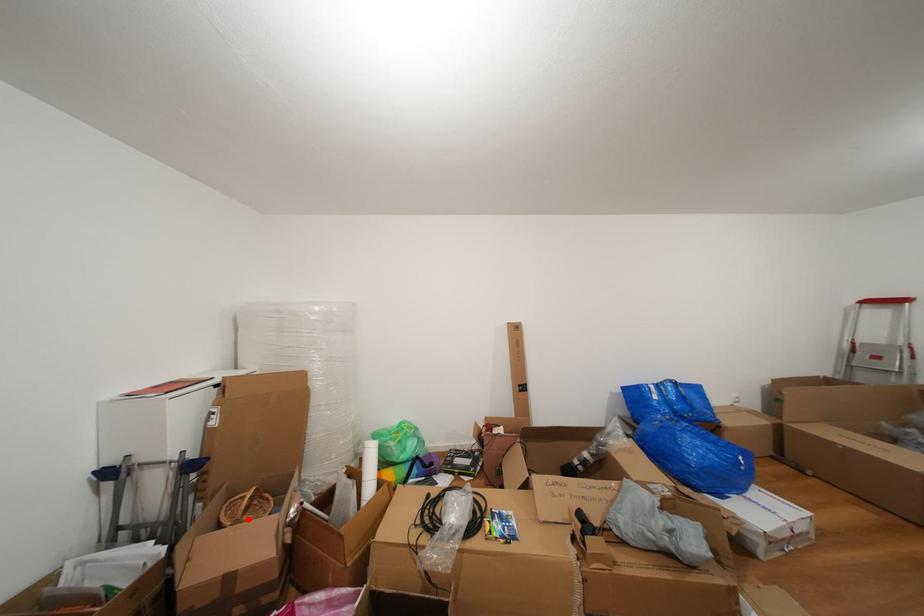
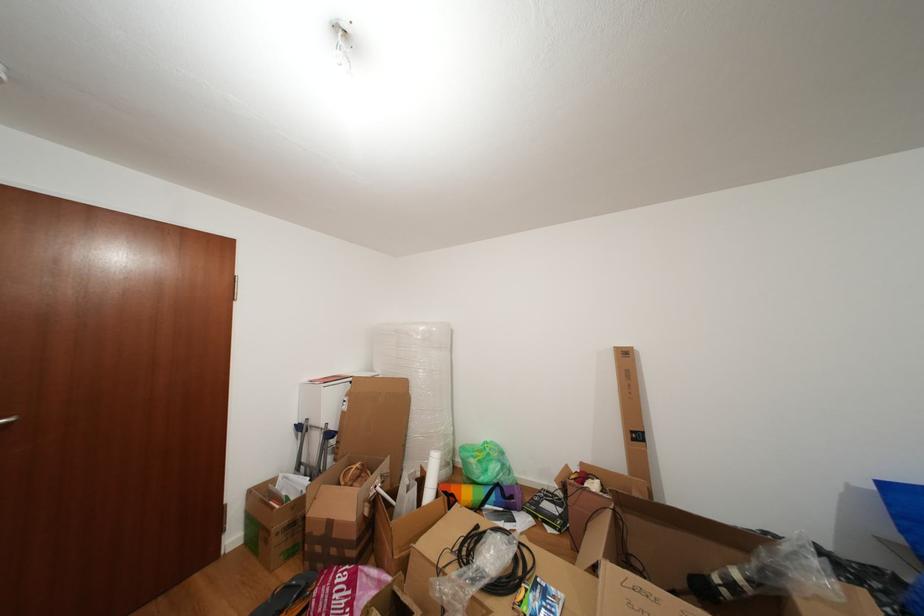
Locate, in the second image, the point that corresponds to the highlighted location in the first image.

(357, 485)